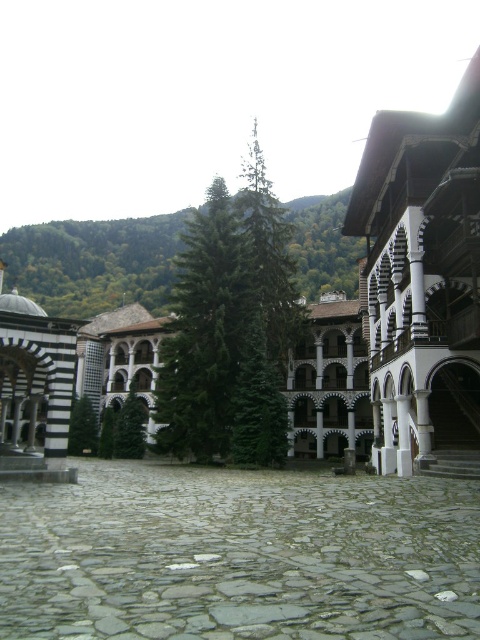
Question: Is white wood palace at right smaller than green textured tree at center?

Choices:
 (A) yes
 (B) no

Answer: (B)

Question: Can you confirm if gray stone courtyard at center is positioned to the left of green textured tree at center?

Choices:
 (A) yes
 (B) no

Answer: (B)

Question: Which of the following is the farthest from the observer?

Choices:
 (A) green matte tree at center
 (B) white stone palace at center
 (C) gray stone courtyard at center
 (D) green textured tree at center

Answer: (D)

Question: Which point appears farthest from the camera in this image?

Choices:
 (A) (132, 432)
 (B) (141, 467)

Answer: (A)

Question: Does gray stone courtyard at center have a smaller size compared to green matte tree at center?

Choices:
 (A) no
 (B) yes

Answer: (A)

Question: Which of the following is the closest to the observer?

Choices:
 (A) (96, 593)
 (B) (113, 442)

Answer: (A)